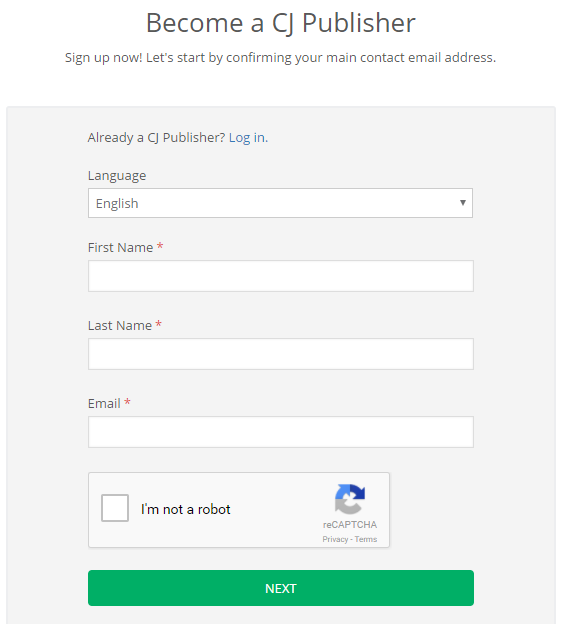
Locate an element on the screen. This screenshot has height=624, width=563. text entry spot is located at coordinates (202, 270), (195, 356), (192, 432).